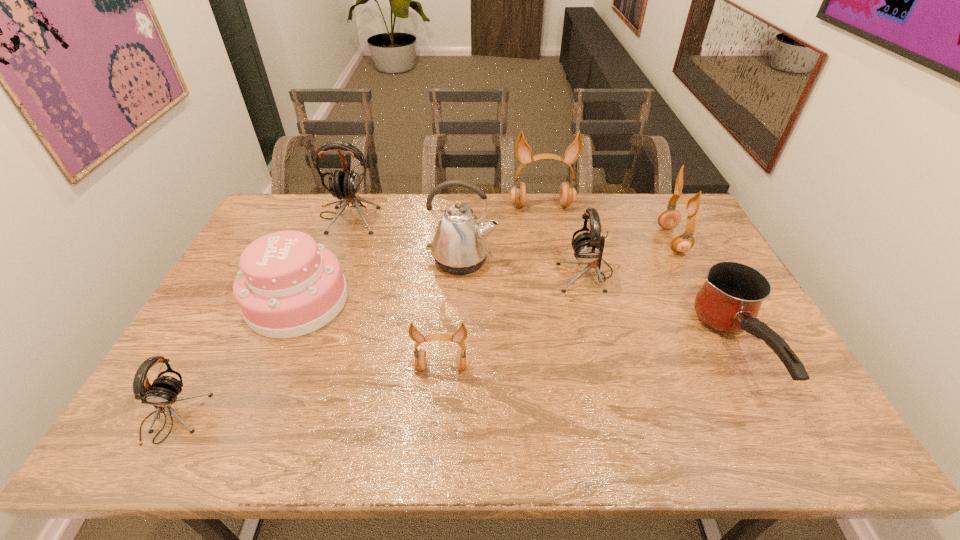
Where is `the farthest brown earphone`? The height and width of the screenshot is (540, 960). the farthest brown earphone is located at coordinates (523, 152).

I want to click on the biggest brown earphone, so click(523, 152).

In order to click on the fifth earphone from right to left in this screenshot , I will do `click(345, 184)`.

The width and height of the screenshot is (960, 540). I want to click on the farthest black earphone, so pos(345,184).

Identify the location of kettle. (460, 246).

Locate an element on the screen. The width and height of the screenshot is (960, 540). the rightmost black earphone is located at coordinates coord(588,247).

The image size is (960, 540). What are the coordinates of `the second nearest black earphone` in the screenshot? It's located at (588, 247).

Identify the location of the rightmost earphone. (670, 218).

Locate an element on the screen. Image resolution: width=960 pixels, height=540 pixels. the rightmost brown earphone is located at coordinates (670, 218).

At what (x,y) coordinates should I click in order to perform the action: click on birthday cake. Please return your answer as a coordinate pair (x, y). The width and height of the screenshot is (960, 540). Looking at the image, I should click on (288, 286).